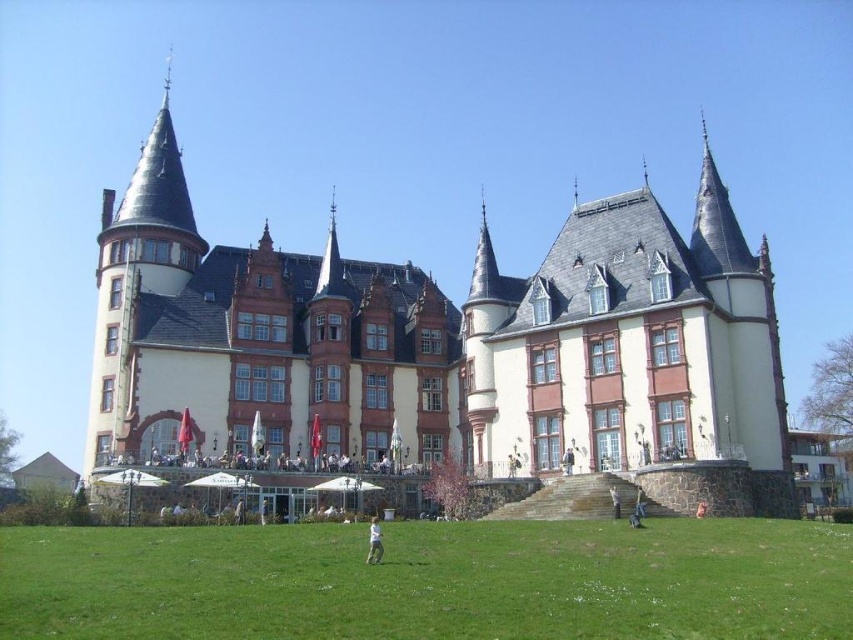
Between point (190, 582) and point (572, 460), which one is positioned in front?

Point (190, 582)

Does point (370, 627) come farther from viewer compared to point (566, 465)?

No, (370, 627) is in front of (566, 465).

Does point (245, 586) lie behind point (570, 449)?

No, it is in front of (570, 449).

You are a GUI agent. You are given a task and a screenshot of the screen. Output one action in this format:
    pyautogui.click(x=<x>, y=<y>)
    Task: Click on the green grass at lower center
    Image resolution: width=853 pixels, height=640 pixels.
    Given the screenshot: What is the action you would take?
    pyautogui.click(x=431, y=580)

Can you confirm if green grass at lower center is shorter than white cotton shirt at lower center?

Correct, green grass at lower center is not as tall as white cotton shirt at lower center.

Image resolution: width=853 pixels, height=640 pixels. In order to click on green grass at lower center in this screenshot , I will do pos(431,580).

Is white cotton shirt at lower center above dark gray fabric jacket at lower center?

No.

Who is lower down, white cotton shirt at lower center or dark gray fabric jacket at lower center?

Positioned lower is white cotton shirt at lower center.

Between point (379, 548) and point (619, 513), which one is positioned in front?

Point (379, 548) is in front.

Image resolution: width=853 pixels, height=640 pixels. I want to click on white cotton shirt at lower center, so click(374, 541).